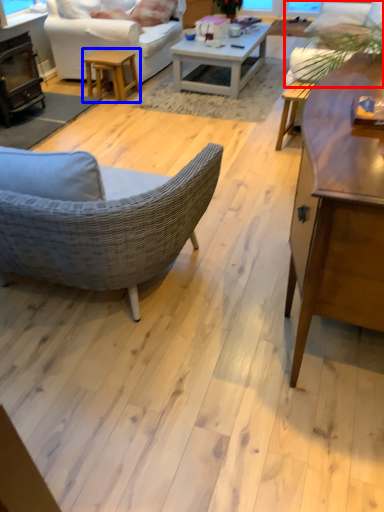
Question: Among these objects, which one is farthest to the camera, couch (highlighted by a red box) or table (highlighted by a blue box)?

Choices:
 (A) couch
 (B) table

Answer: (B)